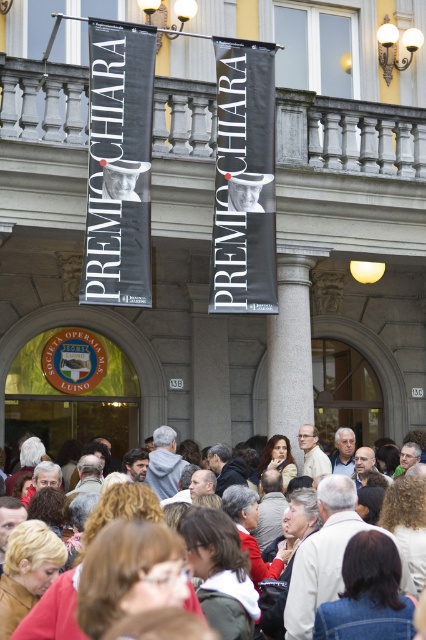
Is black matte banner at upper left thinner than black fabric banner at center?

No, black matte banner at upper left is not thinner than black fabric banner at center.

Describe the element at coordinates (118, 163) in the screenshot. I see `black matte banner at upper left` at that location.

The image size is (426, 640). What are the coordinates of `black matte banner at upper left` in the screenshot? It's located at (118, 163).

Between black fabric banner at center and gray marble pillar at center, which one has more height?

With more height is black fabric banner at center.

Does black fabric banner at center have a lesser width compared to gray marble pillar at center?

In fact, black fabric banner at center might be wider than gray marble pillar at center.

Measure the distance between point (x=230, y=61) and camera.

The distance of point (x=230, y=61) from camera is 47.48 meters.

Locate an element on the screen. The image size is (426, 640). black fabric banner at center is located at coordinates (244, 179).

Which of these two, gray marble pillar at center or multicolored casual attire at center, stands shorter?

gray marble pillar at center

Consider the image. Which of these two, gray marble pillar at center or multicolored casual attire at center, stands taller?

Standing taller between the two is multicolored casual attire at center.

You are a GUI agent. You are given a task and a screenshot of the screen. Output one action in this format:
    pyautogui.click(x=<x>, y=<y>)
    Task: Click on the gray marble pillar at center
    The image size is (426, 640).
    Given the screenshot: What is the action you would take?
    pyautogui.click(x=290, y=349)